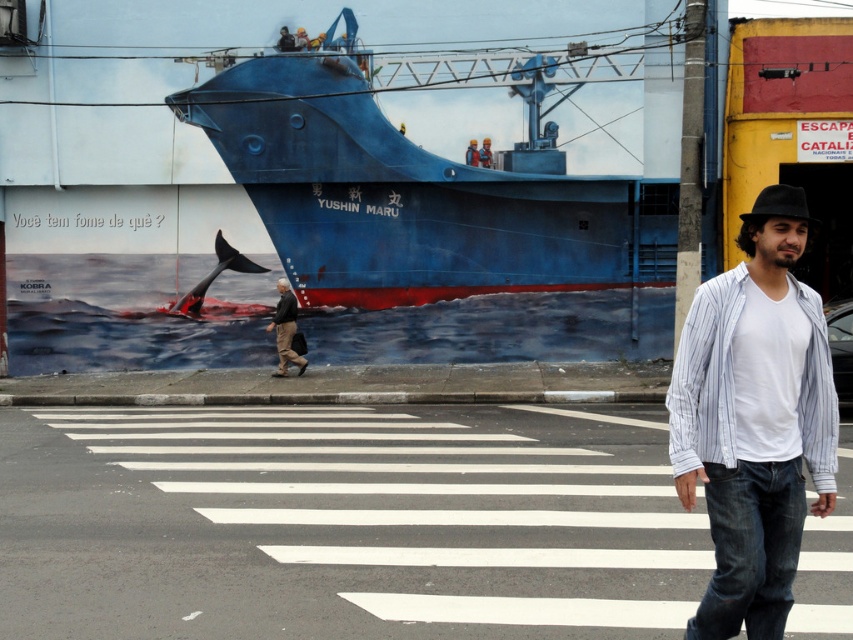
From the picture: You are standing at the pedestrian crossing and want to take a photo of the blue matte ship at center. Where should you position yourself to capture the ship in the frame?

To capture the blue matte ship at center in the frame, position yourself at the pedestrian crossing where the ship is centered in your camera viewfinder, likely near the middle of the crossing since the ship is located at coordinates (416,192) in the image.

You are a delivery person with a 5.5 feet wide cart. You need to cross the street where the blue matte ship at center and brown leather jacket at center are located. Can your cart fit between them?

The blue matte ship at center and brown leather jacket at center are 6.72 feet apart, which is wider than your cart width of 5.5 feet. Your cart can fit between them.

You are standing at the camera position looking at the urban street scene. There is a specific point marked at coordinates point (339, 250). Can you estimate how far this point is from your current position?

The point (339, 250) is 22.49 meters away from the camera, so the distance is approximately 22.49 meters.